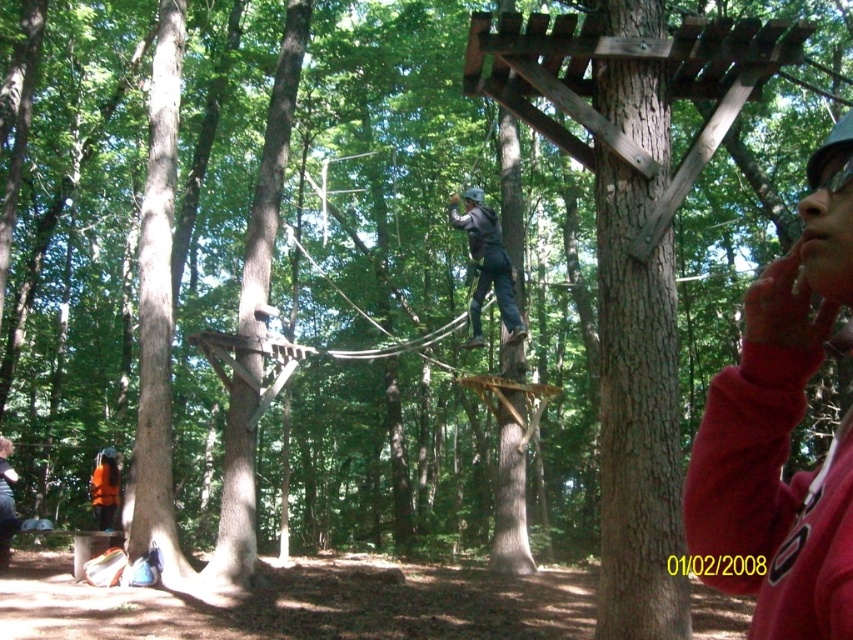
You are a safety inspector reviewing an outdoor adventure setup. You notice two items in the image. The first is the matte red sweatshirt at upper right, and the second is the dark gray fabric harness at center. Which of these items appears to be the smaller one in the image?

The matte red sweatshirt at upper right is smaller than the dark gray fabric harness at center.

You are a safety inspector reviewing the outdoor adventure setup. You notice two items in the scene, the matte red sweatshirt at upper right and the orange life vest at lower left. According to safety protocols, all safety gear must be placed below the participant area to ensure quick access. Does the current placement of these items comply with the safety regulations?

The matte red sweatshirt at upper right is above the orange life vest at lower left, which means the sweatshirt is positioned higher than the required placement. Since safety gear must be placed below the participant area for quick access, the current placement does not comply with safety regulations.

You are a safety inspector assessing the distance between the matte red sweatshirt at upper right and the dark gray fabric harness at center in the wooded obstacle course. According to safety regulations, the maximum allowed distance between these two items should not exceed 5 meters. Is the current distance compliant with the regulations?

The matte red sweatshirt at upper right and dark gray fabric harness at center are 7.35 meters apart from each other, which exceeds the 5 meters maximum allowed distance. Therefore, the current distance is not compliant with the regulations.